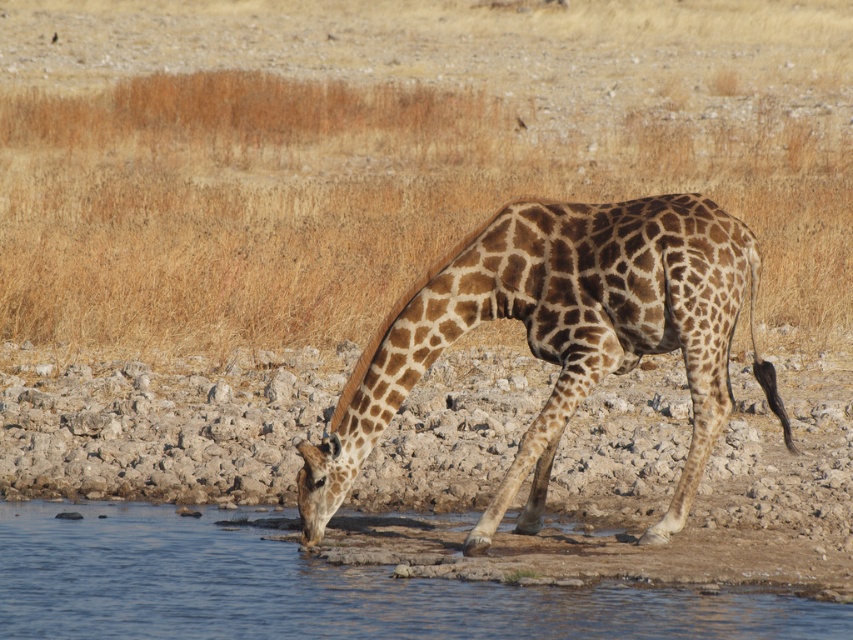
Which is in front, point (328, 52) or point (418, 292)?

Point (418, 292)

Image resolution: width=853 pixels, height=640 pixels. Describe the element at coordinates (392, 154) in the screenshot. I see `brown dry grass at center` at that location.

Where is `brown dry grass at center`? brown dry grass at center is located at coordinates (392, 154).

Is point (531, 483) positioned in front of point (815, 605)?

No, it is not.

Between spotted fur giraffe at center and clear water at lower left, which one is positioned higher?

Positioned higher is spotted fur giraffe at center.

Image resolution: width=853 pixels, height=640 pixels. What are the coordinates of `spotted fur giraffe at center` in the screenshot? It's located at (556, 333).

Does brown dry grass at center have a greater width compared to clear water at lower left?

Yes, brown dry grass at center is wider than clear water at lower left.

Between brown dry grass at center and clear water at lower left, which one is positioned lower?

clear water at lower left is lower down.

Image resolution: width=853 pixels, height=640 pixels. I want to click on brown dry grass at center, so click(392, 154).